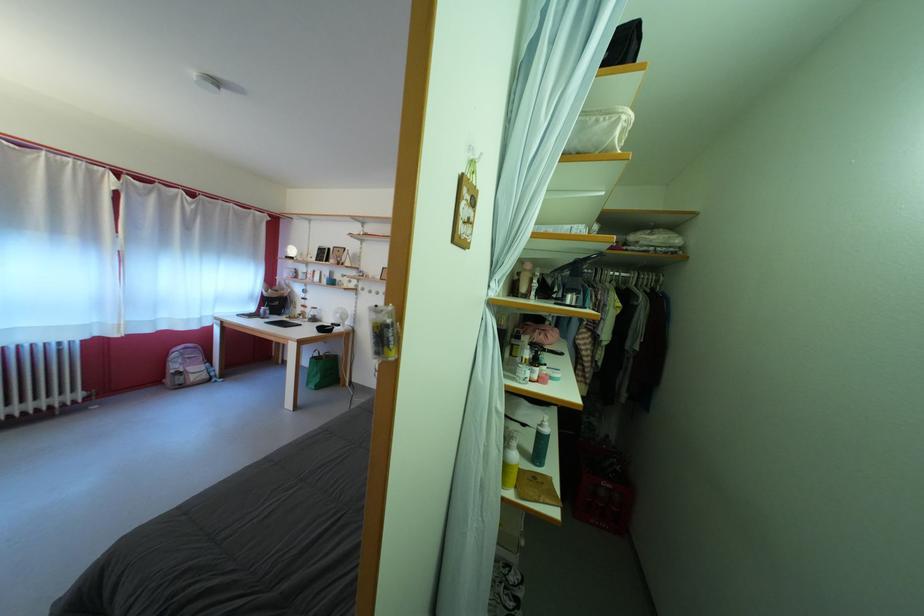
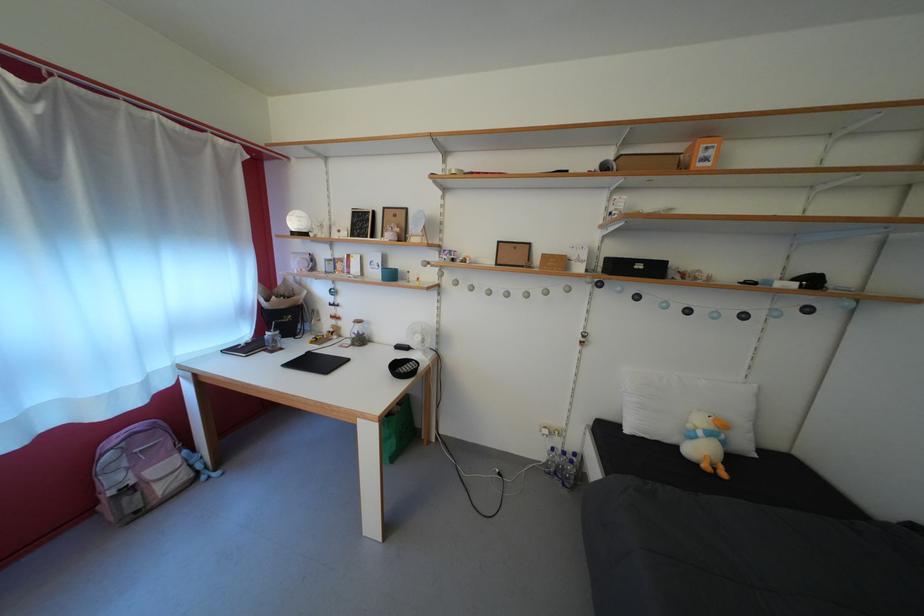
The point at (319, 318) is marked in the first image. Where is the corresponding point in the second image?

(358, 334)